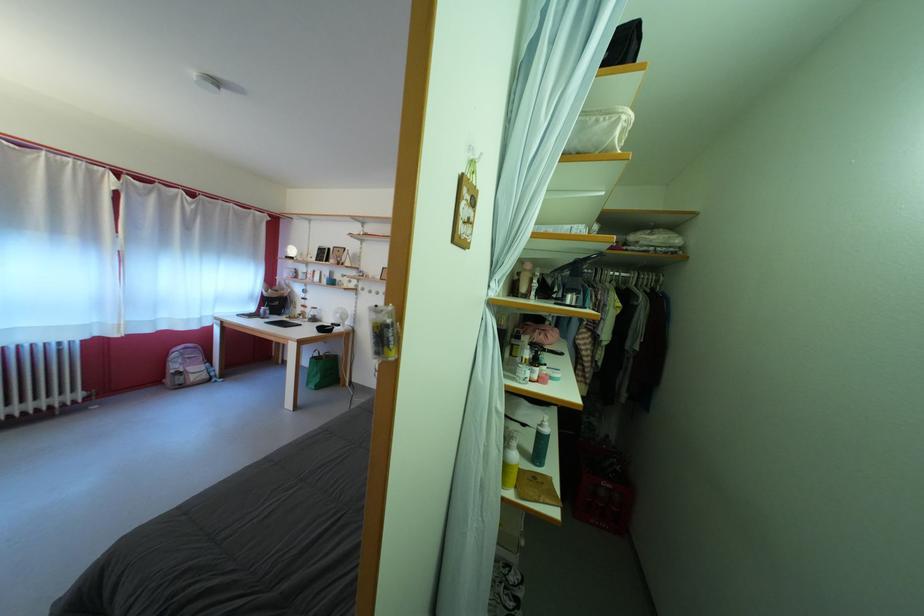
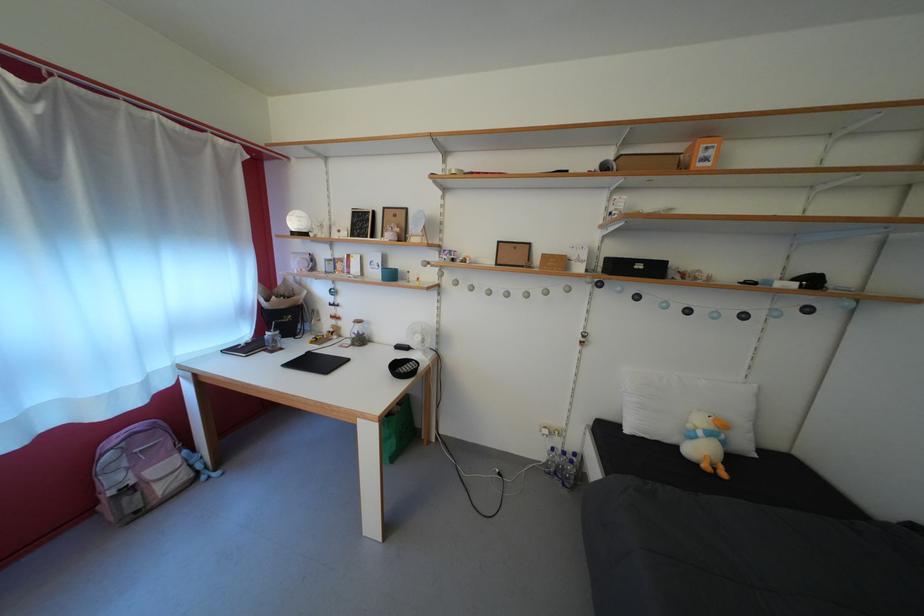
The point at (319, 318) is marked in the first image. Where is the corresponding point in the second image?

(358, 334)